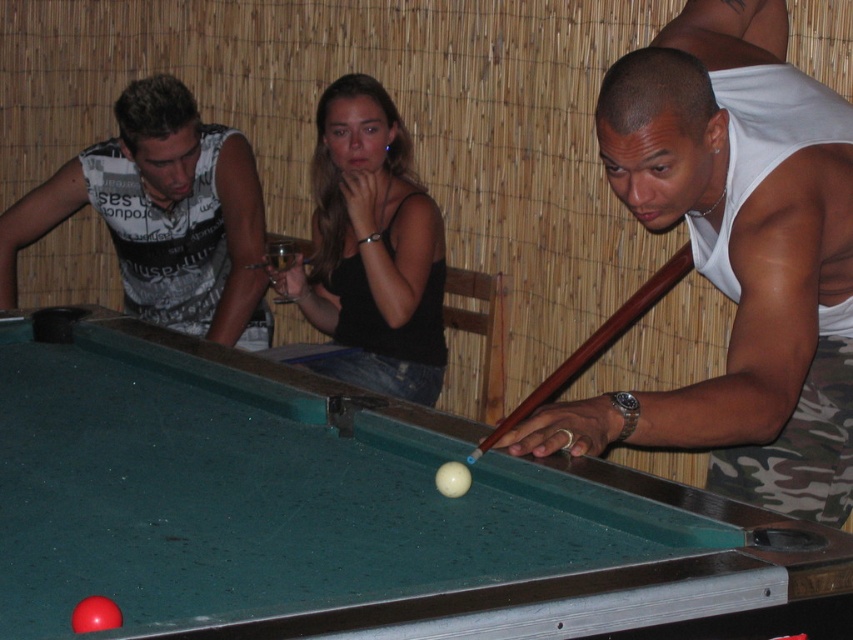
Between white printed tank top at left and brown wood pool cue at center, which one appears on the right side from the viewer's perspective?

From the viewer's perspective, brown wood pool cue at center appears more on the right side.

Can you confirm if white printed tank top at left is positioned below brown wood pool cue at center?

No.

Between point (213, 307) and point (677, 278), which one is positioned behind?

Positioned behind is point (213, 307).

Identify the location of white printed tank top at left. This screenshot has width=853, height=640. (161, 216).

Is green felt billiard table at center to the left of white printed tank top at left from the viewer's perspective?

In fact, green felt billiard table at center is to the right of white printed tank top at left.

Between green felt billiard table at center and white printed tank top at left, which one appears on the right side from the viewer's perspective?

Positioned to the right is green felt billiard table at center.

This screenshot has height=640, width=853. What are the coordinates of `green felt billiard table at center` in the screenshot? It's located at (335, 509).

Based on the photo, who is more forward, (187, 212) or (368, 346)?

Point (368, 346)

Is white printed tank top at left positioned behind black matte tank top at center?

That is True.

Is point (231, 180) in front of point (376, 244)?

That is False.

Locate an element on the screen. The image size is (853, 640). white printed tank top at left is located at coordinates (161, 216).